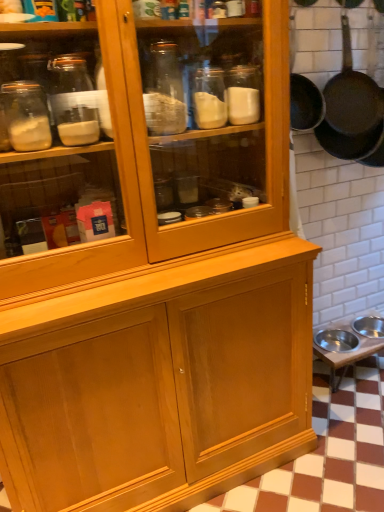
Question: Is dark brown matte frying pan at upper right situated inside metallic silver table at lower right or outside?

Choices:
 (A) inside
 (B) outside

Answer: (B)

Question: Does point (339, 123) appear closer or farther from the camera than point (326, 358)?

Choices:
 (A) farther
 (B) closer

Answer: (B)

Question: From the image's perspective, relative to metallic silver table at lower right, is dark brown matte frying pan at upper right above or below?

Choices:
 (A) below
 (B) above

Answer: (B)

Question: In the image, is metallic silver table at lower right positioned in front of or behind dark brown matte frying pan at upper right?

Choices:
 (A) front
 (B) behind

Answer: (B)

Question: Considering the positions of point (319, 333) and point (327, 91), is point (319, 333) closer or farther from the camera than point (327, 91)?

Choices:
 (A) farther
 (B) closer

Answer: (A)

Question: Considering the relative positions of metallic silver table at lower right and dark brown matte frying pan at upper right in the image provided, is metallic silver table at lower right to the left or to the right of dark brown matte frying pan at upper right?

Choices:
 (A) left
 (B) right

Answer: (B)

Question: In terms of height, does metallic silver table at lower right look taller or shorter compared to dark brown matte frying pan at upper right?

Choices:
 (A) tall
 (B) short

Answer: (B)